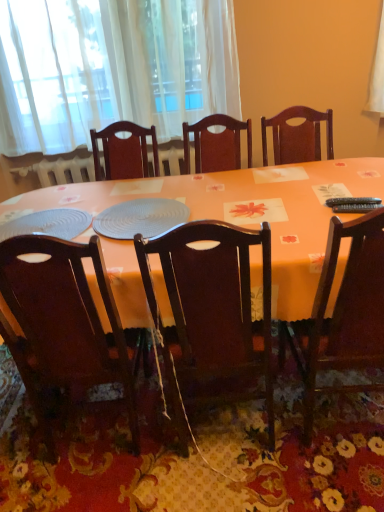
Question: Does orange fabric table at center touch wooden chair at right, the 3th chair in the left-to-right sequence?

Choices:
 (A) no
 (B) yes

Answer: (A)

Question: Is orange fabric table at center positioned far away from wooden chair at right, the 3th chair in the left-to-right sequence?

Choices:
 (A) no
 (B) yes

Answer: (A)

Question: Is orange fabric table at center in front of wooden chair at right, which is the first chair in right-to-left order?

Choices:
 (A) yes
 (B) no

Answer: (B)

Question: Considering the relative sizes of orange fabric table at center and wooden chair at right, the 3th chair in the left-to-right sequence, in the image provided, is orange fabric table at center thinner than wooden chair at right, the 3th chair in the left-to-right sequence,?

Choices:
 (A) yes
 (B) no

Answer: (B)

Question: Does orange fabric table at center have a greater height compared to wooden chair at right, which is the first chair in right-to-left order?

Choices:
 (A) no
 (B) yes

Answer: (A)

Question: Visually, is dark wood chair at center, marked as the 2th chair in a right-to-left arrangement, positioned to the left or to the right of white sheer curtain at upper left?

Choices:
 (A) left
 (B) right

Answer: (B)

Question: In terms of width, does dark wood chair at center, which is the second chair in left-to-right order, look wider or thinner when compared to white sheer curtain at upper left?

Choices:
 (A) thin
 (B) wide

Answer: (B)

Question: Is dark wood chair at center, marked as the 2th chair in a right-to-left arrangement, situated inside white sheer curtain at upper left or outside?

Choices:
 (A) inside
 (B) outside

Answer: (B)

Question: From a real-world perspective, is dark wood chair at center, marked as the 2th chair in a right-to-left arrangement, above or below white sheer curtain at upper left?

Choices:
 (A) above
 (B) below

Answer: (B)

Question: From the image's perspective, relative to dark wood chair at lower left, the 3th chair when ordered from right to left, is dark wood chair at center, marked as the 2th chair in a right-to-left arrangement, above or below?

Choices:
 (A) above
 (B) below

Answer: (A)

Question: Considering the positions of point (269, 314) and point (105, 364), is point (269, 314) closer or farther from the camera than point (105, 364)?

Choices:
 (A) closer
 (B) farther

Answer: (A)

Question: Is dark wood chair at center, marked as the 2th chair in a right-to-left arrangement, to the left or to the right of dark wood chair at lower left, the 3th chair when ordered from right to left, in the image?

Choices:
 (A) left
 (B) right

Answer: (B)

Question: From a real-world perspective, is dark wood chair at center, which is the second chair in left-to-right order, physically located above or below dark wood chair at lower left, arranged as the 1th chair when viewed from the left?

Choices:
 (A) below
 (B) above

Answer: (B)

Question: Choose the correct answer: Is black plastic remote control at right, arranged as the first remote control when viewed from the top, inside dark wood chair at center, marked as the 2th chair in a right-to-left arrangement, or outside it?

Choices:
 (A) outside
 (B) inside

Answer: (A)

Question: From the image's perspective, is black plastic remote control at right, arranged as the first remote control when viewed from the top, positioned above or below dark wood chair at center, marked as the 2th chair in a right-to-left arrangement?

Choices:
 (A) above
 (B) below

Answer: (A)